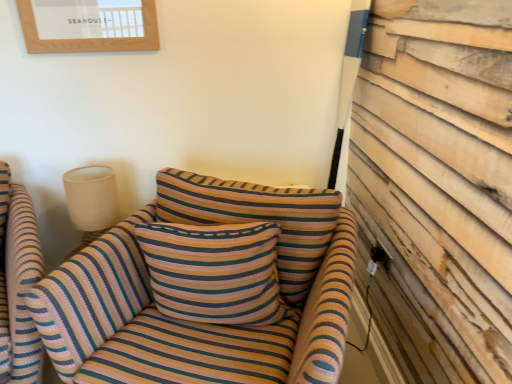
Question: From the image's perspective, is striped fabric pillow at center on top of striped fabric chair at left?

Choices:
 (A) yes
 (B) no

Answer: (A)

Question: Does striped fabric pillow at center come in front of striped fabric chair at left?

Choices:
 (A) no
 (B) yes

Answer: (A)

Question: Would you consider striped fabric pillow at center to be distant from striped fabric chair at left?

Choices:
 (A) yes
 (B) no

Answer: (B)

Question: Does striped fabric pillow at center have a smaller size compared to striped fabric chair at left?

Choices:
 (A) yes
 (B) no

Answer: (A)

Question: Is striped fabric pillow at center touching striped fabric chair at left?

Choices:
 (A) yes
 (B) no

Answer: (B)

Question: Considering the relative sizes of striped fabric pillow at center and striped fabric chair at left in the image provided, is striped fabric pillow at center thinner than striped fabric chair at left?

Choices:
 (A) no
 (B) yes

Answer: (B)

Question: Is striped fabric chair at left looking in the opposite direction of striped fabric couch at center?

Choices:
 (A) no
 (B) yes

Answer: (A)

Question: From a real-world perspective, is striped fabric chair at left located beneath striped fabric couch at center?

Choices:
 (A) yes
 (B) no

Answer: (A)

Question: Could you tell me if striped fabric chair at left is turned towards striped fabric couch at center?

Choices:
 (A) no
 (B) yes

Answer: (A)

Question: Can you confirm if striped fabric chair at left is taller than striped fabric couch at center?

Choices:
 (A) no
 (B) yes

Answer: (B)

Question: Does striped fabric chair at left have a lesser width compared to striped fabric couch at center?

Choices:
 (A) yes
 (B) no

Answer: (B)

Question: Is striped fabric chair at left not within striped fabric couch at center?

Choices:
 (A) no
 (B) yes

Answer: (B)

Question: Considering the relative sizes of striped fabric pillow at center and striped fabric couch at center in the image provided, is striped fabric pillow at center shorter than striped fabric couch at center?

Choices:
 (A) yes
 (B) no

Answer: (A)